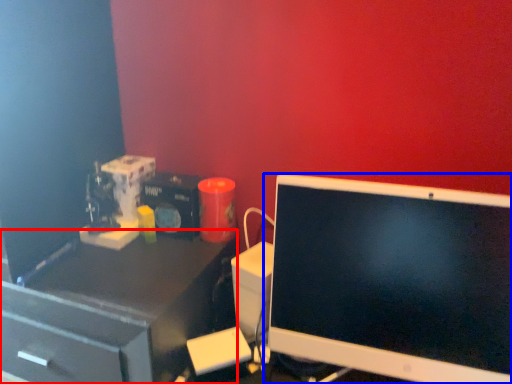
Question: Among these objects, which one is farthest to the camera, desk (highlighted by a red box) or computer monitor (highlighted by a blue box)?

Choices:
 (A) desk
 (B) computer monitor

Answer: (A)